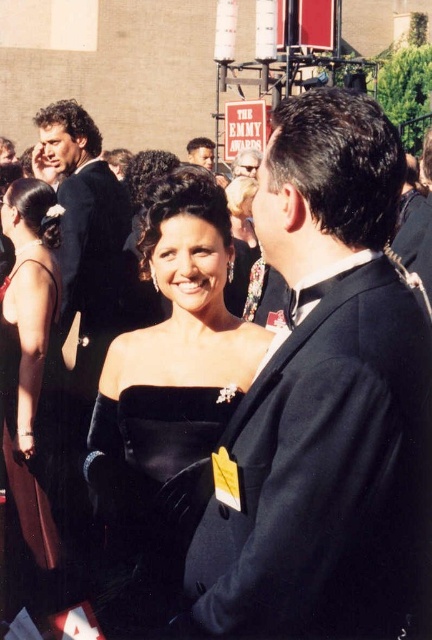
Who is more forward, (x=95, y=168) or (x=206, y=145)?

Positioned in front is point (x=95, y=168).

Can you confirm if shiny black suit at left is smaller than dark brown hair at center?

Indeed, shiny black suit at left has a smaller size compared to dark brown hair at center.

You are a GUI agent. You are given a task and a screenshot of the screen. Output one action in this format:
    pyautogui.click(x=<x>, y=<y>)
    Task: Click on the shiny black suit at left
    The height and width of the screenshot is (640, 432).
    Given the screenshot: What is the action you would take?
    pyautogui.click(x=85, y=232)

Is black satin suit at center below dark brown hair at center?

Correct, black satin suit at center is located below dark brown hair at center.

Who is shorter, black satin suit at center or dark brown hair at center?

dark brown hair at center

Describe the element at coordinates (324, 401) in the screenshot. The height and width of the screenshot is (640, 432). I see `black satin suit at center` at that location.

You are a GUI agent. You are given a task and a screenshot of the screen. Output one action in this format:
    pyautogui.click(x=<x>, y=<y>)
    Task: Click on the black satin suit at center
    Image resolution: width=432 pixels, height=640 pixels.
    Given the screenshot: What is the action you would take?
    pyautogui.click(x=324, y=401)

Which is above, black satin suit at center or shiny black suit at left?

shiny black suit at left is higher up.

Is black satin suit at center closer to camera compared to shiny black suit at left?

Yes, black satin suit at center is in front of shiny black suit at left.

This screenshot has width=432, height=640. What do you see at coordinates (324, 401) in the screenshot? I see `black satin suit at center` at bounding box center [324, 401].

This screenshot has width=432, height=640. I want to click on black satin suit at center, so click(x=324, y=401).